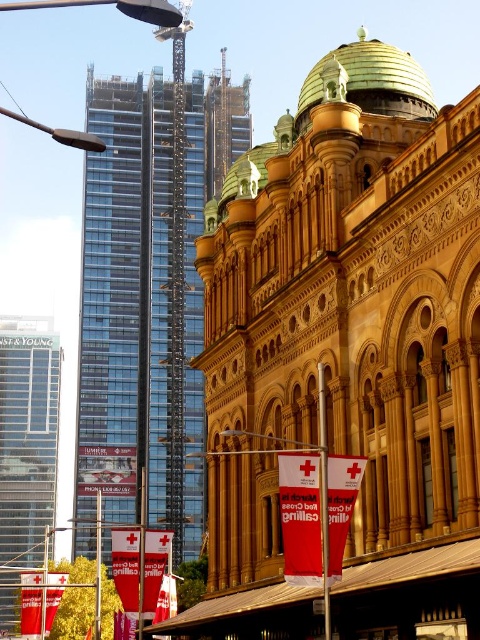
Question: Which of the following is the farthest from the observer?

Choices:
 (A) (325, 540)
 (B) (8, 346)

Answer: (B)

Question: Does glassy steel tower at left appear on the left side of metallic pole at center?

Choices:
 (A) no
 (B) yes

Answer: (B)

Question: Observing the image, what is the correct spatial positioning of glassy steel tower at left in reference to red plastic pole at center?

Choices:
 (A) below
 (B) above

Answer: (A)

Question: Can you confirm if glassy steel tower at left is positioned above red plastic pole at center?

Choices:
 (A) yes
 (B) no

Answer: (B)

Question: Which object is closer to the camera taking this photo?

Choices:
 (A) red plastic pole at center
 (B) glassy steel tower at left
 (C) glassy steel tower at upper left

Answer: (A)

Question: Which point is closer to the camera taking this photo?

Choices:
 (A) (96, 496)
 (B) (324, 518)

Answer: (B)